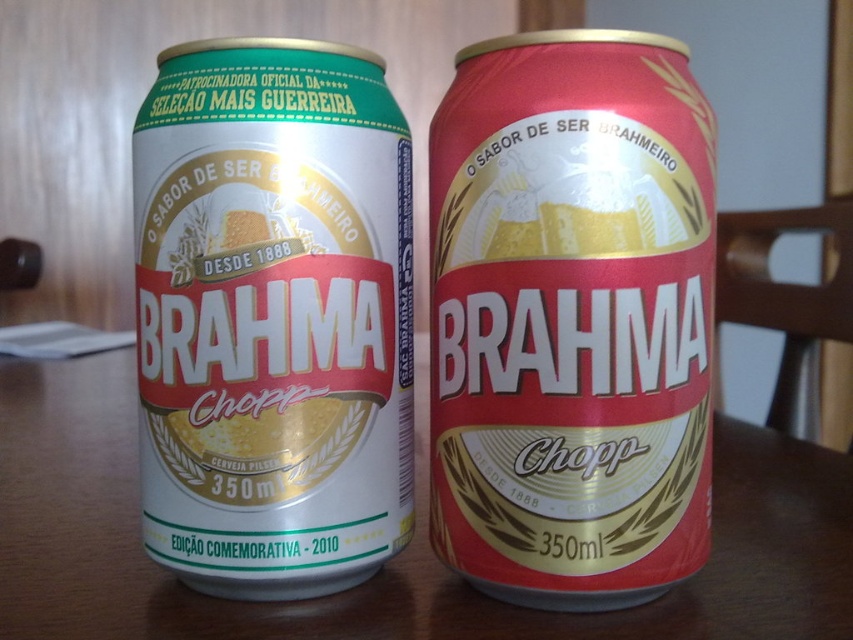
Question: Which of the following is the closest to the observer?

Choices:
 (A) white matte can at center
 (B) wooden table at center

Answer: (B)

Question: Is white matte can at center in front of wooden table at center?

Choices:
 (A) no
 (B) yes

Answer: (A)

Question: Which point appears farthest from the camera in this image?

Choices:
 (A) (726, 525)
 (B) (614, 461)

Answer: (A)

Question: Is white matte can at center to the left of wooden table at center from the viewer's perspective?

Choices:
 (A) no
 (B) yes

Answer: (A)

Question: Which of the following is the closest to the observer?

Choices:
 (A) wooden table at center
 (B) white matte can at center

Answer: (A)

Question: Can you confirm if white matte can at center is wider than wooden table at center?

Choices:
 (A) yes
 (B) no

Answer: (B)